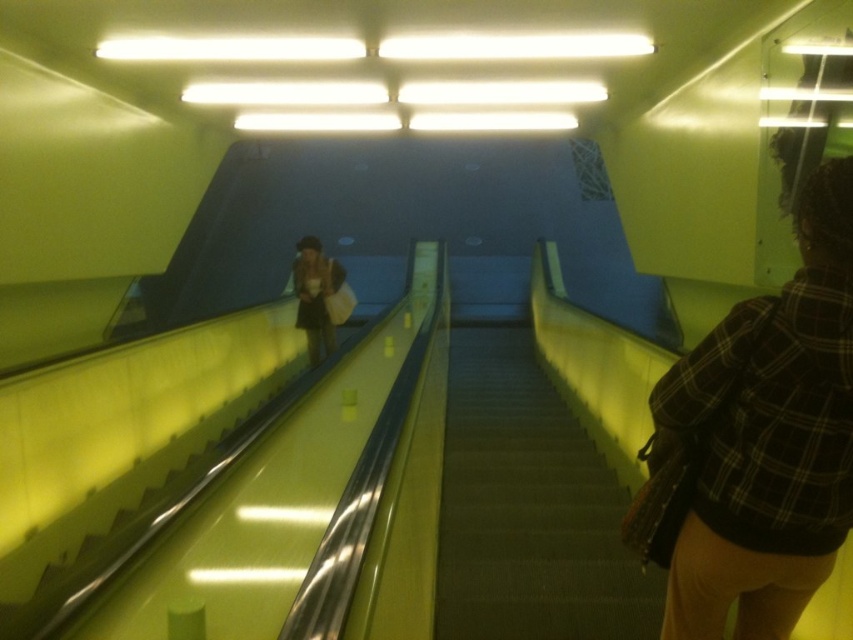
Question: Considering the relative positions of dark gray carpeted stairs at center and matte beige bag at center in the image provided, where is dark gray carpeted stairs at center located with respect to matte beige bag at center?

Choices:
 (A) below
 (B) above

Answer: (A)

Question: Can you confirm if dark gray carpeted stairs at center is positioned to the left of matte beige bag at center?

Choices:
 (A) yes
 (B) no

Answer: (B)

Question: Considering the real-world distances, which object is farthest from the dark gray carpeted stairs at center?

Choices:
 (A) matte beige bag at center
 (B) plaid fabric shirt at right

Answer: (A)

Question: Can you confirm if plaid fabric shirt at right is smaller than matte beige bag at center?

Choices:
 (A) no
 (B) yes

Answer: (B)

Question: Among these objects, which one is farthest from the camera?

Choices:
 (A) plaid fabric shirt at right
 (B) matte beige bag at center
 (C) dark gray carpeted stairs at center

Answer: (B)

Question: Which of the following is the closest to the observer?

Choices:
 (A) dark gray carpeted stairs at center
 (B) matte beige bag at center

Answer: (A)